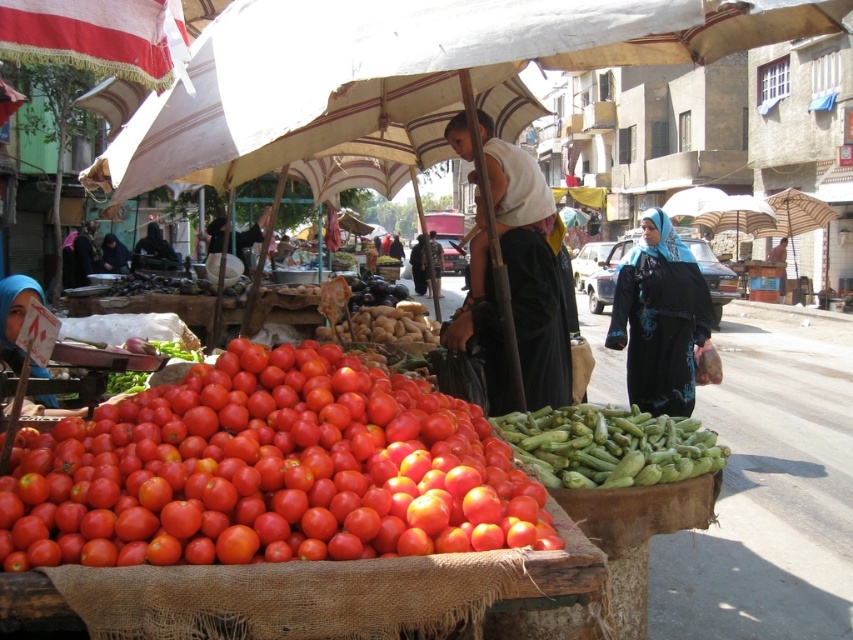
In the scene shown: Does black fabric headscarf at right have a greater height compared to green matte okra at lower center?

Correct, black fabric headscarf at right is much taller as green matte okra at lower center.

Locate an element on the screen. This screenshot has width=853, height=640. black fabric headscarf at right is located at coordinates (659, 317).

Is point (682, 413) behind point (618, 468)?

Yes, point (682, 413) is behind point (618, 468).

Find the location of a particular element. black fabric headscarf at right is located at coordinates (659, 317).

Who is shorter, shiny red tomatoes at lower left or matte blue hijab at lower left?

Standing shorter between the two is shiny red tomatoes at lower left.

Is point (279, 401) positioned in front of point (53, 401)?

Yes, it is.

Between point (428, 506) and point (0, 339), which one is positioned behind?

The point (0, 339) is more distant.

Locate an element on the screen. Image resolution: width=853 pixels, height=640 pixels. shiny red tomatoes at lower left is located at coordinates (267, 472).

Is shiny red tomatoes at lower left thinner than black fabric headscarf at right?

No.

Can you confirm if shiny red tomatoes at lower left is positioned to the left of black fabric headscarf at right?

Indeed, shiny red tomatoes at lower left is positioned on the left side of black fabric headscarf at right.

Describe the element at coordinates (267, 472) in the screenshot. I see `shiny red tomatoes at lower left` at that location.

Identify the location of shiny red tomatoes at lower left. (267, 472).